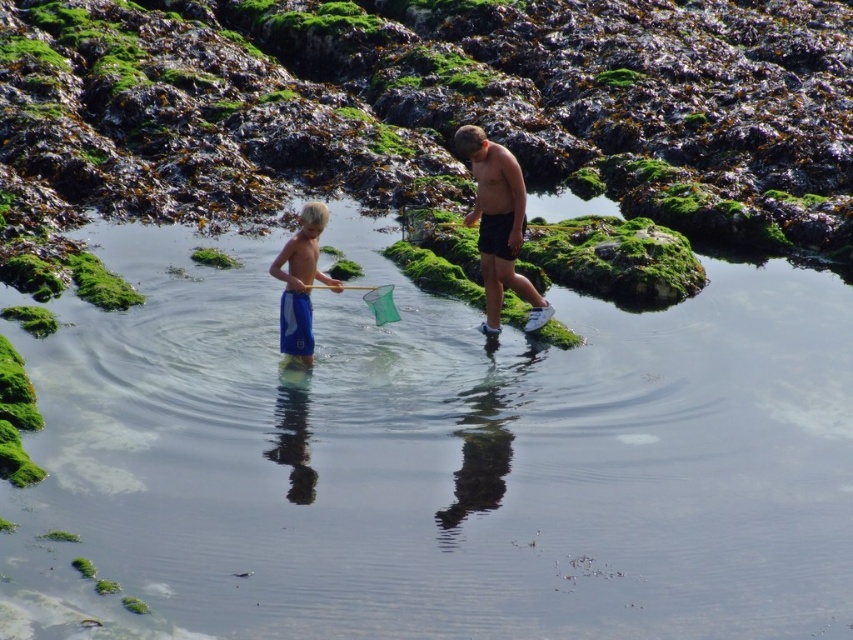
Question: Among these points, which one is farthest from the camera?

Choices:
 (A) (473, 132)
 (B) (216, 257)

Answer: (B)

Question: Is clear water at center thinner than blue shorts at center?

Choices:
 (A) yes
 (B) no

Answer: (B)

Question: Can you confirm if blue shorts at center is positioned below green mossy algae at upper center?

Choices:
 (A) no
 (B) yes

Answer: (B)

Question: Does green mossy algae at center appear on the right side of green mossy algae at upper center?

Choices:
 (A) yes
 (B) no

Answer: (B)

Question: Among these objects, which one is nearest to the camera?

Choices:
 (A) green mossy algae at upper center
 (B) skinny white shorts at center
 (C) green mossy algae at center
 (D) clear water at center

Answer: (D)

Question: Among these objects, which one is farthest from the camera?

Choices:
 (A) green mossy algae at center
 (B) skinny white shorts at center

Answer: (A)